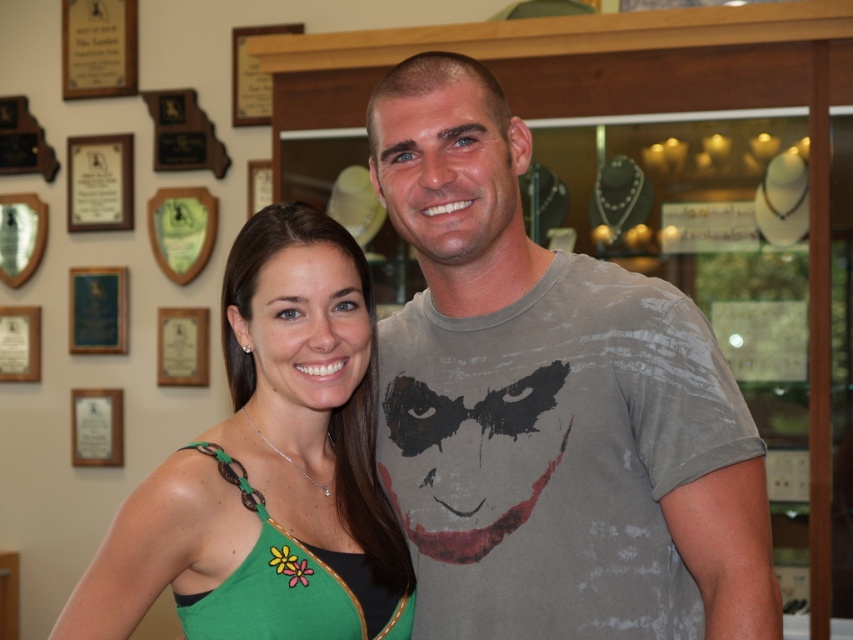
You are standing in a jewelry store and see the green wood plaque at upper left. If you want to place a small sticker exactly at its center, what coordinates should you aim for?

The green wood plaque at upper left is located at coordinates point (181,230), so you should aim for those coordinates to place the sticker at its center.

You are a customer in a jewelry store and want to read both the matte wood plaque at upper left and the matte white plaque at lower left. Which plaque will you need to look up more to read?

The matte wood plaque at upper left is much taller than the matte white plaque at lower left, so you will need to look up more to read the matte wood plaque at upper left.

You are taking a photo of two people standing in a jewelry store. You want to focus on the person closer to the camera. Which of the two points, point (102, 177) or point (112, 323), should you focus on?

Point (102, 177) is closer to the camera than point (112, 323), so you should focus on point (102, 177) to capture the person closer to the camera.